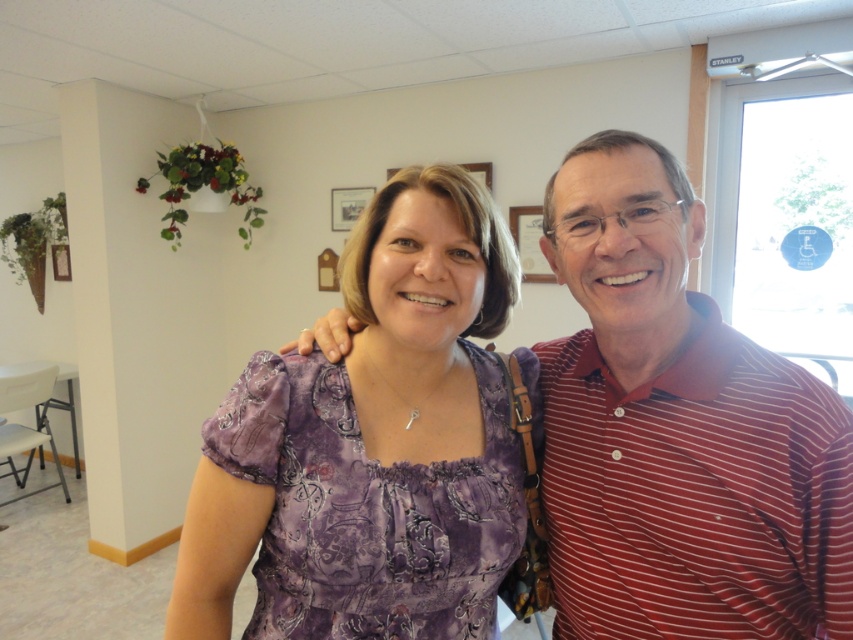
Is point (670, 560) behind point (402, 358)?

No, (670, 560) is in front of (402, 358).

Between point (614, 298) and point (300, 483), which one is positioned in front?

Point (614, 298) is more forward.

The width and height of the screenshot is (853, 640). I want to click on striped cotton shirt at right, so click(677, 429).